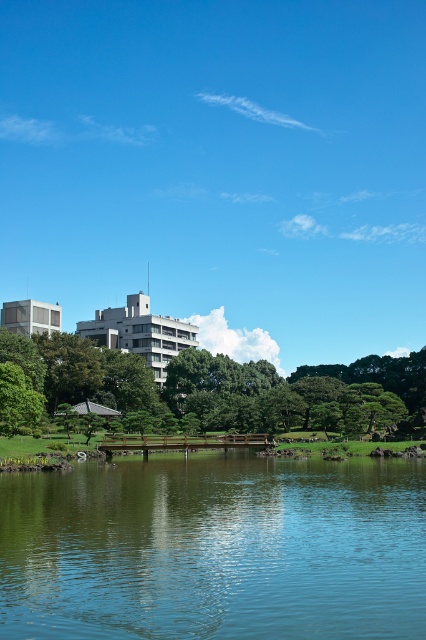
Question: Which point is farther from the camera taking this photo?

Choices:
 (A) (259, 598)
 (B) (109, 368)

Answer: (B)

Question: Does transparent glass water at center have a lesser width compared to green leafy tree at center?

Choices:
 (A) yes
 (B) no

Answer: (A)

Question: Is transparent glass water at center bigger than green leafy tree at center?

Choices:
 (A) yes
 (B) no

Answer: (B)

Question: Can you confirm if transparent glass water at center is positioned to the left of green leafy tree at center?

Choices:
 (A) no
 (B) yes

Answer: (B)

Question: Which of the following is the closest to the observer?

Choices:
 (A) green leafy tree at center
 (B) transparent glass water at center

Answer: (B)

Question: Among these objects, which one is nearest to the camera?

Choices:
 (A) transparent glass water at center
 (B) green leafy tree at center

Answer: (A)